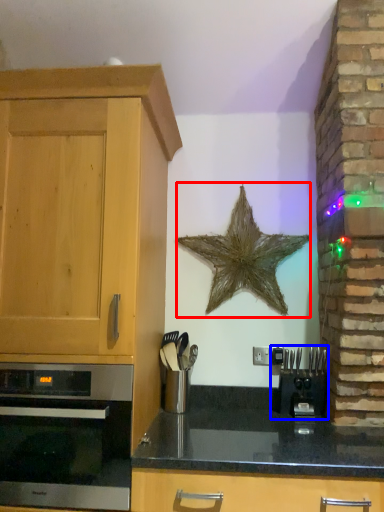
Question: Among these objects, which one is farthest to the camera, starfish (highlighted by a red box) or coffee machine (highlighted by a blue box)?

Choices:
 (A) starfish
 (B) coffee machine

Answer: (A)